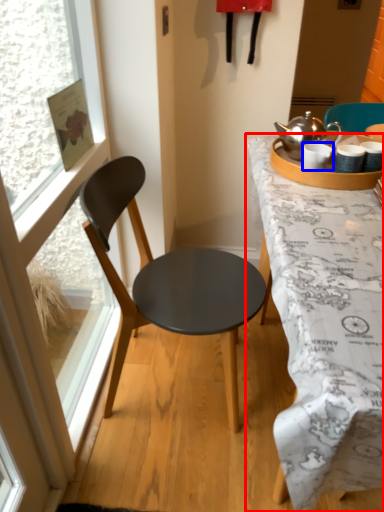
Question: Which point is further to the camera, desk (highlighted by a red box) or coffee cup (highlighted by a blue box)?

Choices:
 (A) desk
 (B) coffee cup

Answer: (B)